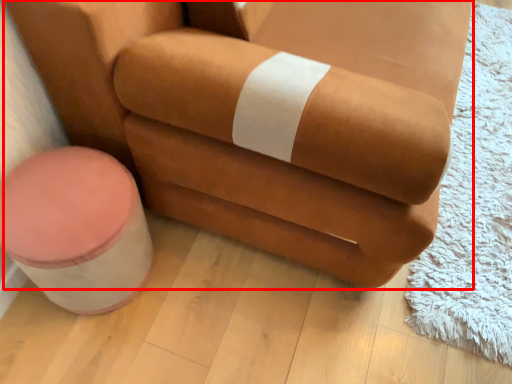
Question: From the image's perspective, what is the correct spatial positioning of chair (annotated by the red box) in reference to stool?

Choices:
 (A) below
 (B) above

Answer: (B)